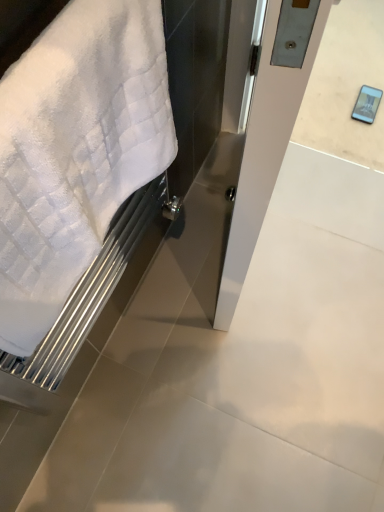
Question: Is the position of white soft towel at left less distant than that of satin silver door at center?

Choices:
 (A) yes
 (B) no

Answer: (A)

Question: From a real-world perspective, is white soft towel at left positioned over satin silver door at center based on gravity?

Choices:
 (A) yes
 (B) no

Answer: (A)

Question: Would you consider white soft towel at left to be distant from satin silver door at center?

Choices:
 (A) no
 (B) yes

Answer: (A)

Question: Is white soft towel at left positioned with its back to satin silver door at center?

Choices:
 (A) yes
 (B) no

Answer: (B)

Question: Does white soft towel at left have a lesser height compared to satin silver door at center?

Choices:
 (A) no
 (B) yes

Answer: (B)

Question: Does white soft towel at left have a smaller size compared to satin silver door at center?

Choices:
 (A) yes
 (B) no

Answer: (A)

Question: Can you confirm if satin silver door at center is wider than white soft towel at left?

Choices:
 (A) no
 (B) yes

Answer: (B)

Question: Does satin silver door at center appear on the left side of white soft towel at left?

Choices:
 (A) yes
 (B) no

Answer: (B)

Question: Is satin silver door at center to the right of white soft towel at left from the viewer's perspective?

Choices:
 (A) no
 (B) yes

Answer: (B)

Question: Considering the relative sizes of satin silver door at center and white soft towel at left in the image provided, is satin silver door at center smaller than white soft towel at left?

Choices:
 (A) no
 (B) yes

Answer: (A)

Question: Is satin silver door at center bigger than white soft towel at left?

Choices:
 (A) no
 (B) yes

Answer: (B)

Question: Is white soft towel at left completely or partially inside satin silver door at center?

Choices:
 (A) no
 (B) yes

Answer: (A)

Question: Is point (269, 117) positioned closer to the camera than point (127, 76)?

Choices:
 (A) farther
 (B) closer

Answer: (B)